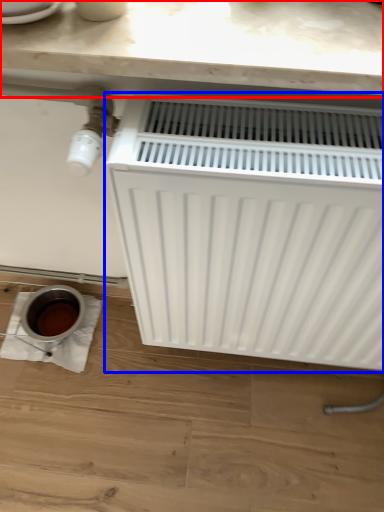
Question: Among these objects, which one is nearest to the camera, counter top (highlighted by a red box) or radiator (highlighted by a blue box)?

Choices:
 (A) counter top
 (B) radiator

Answer: (B)